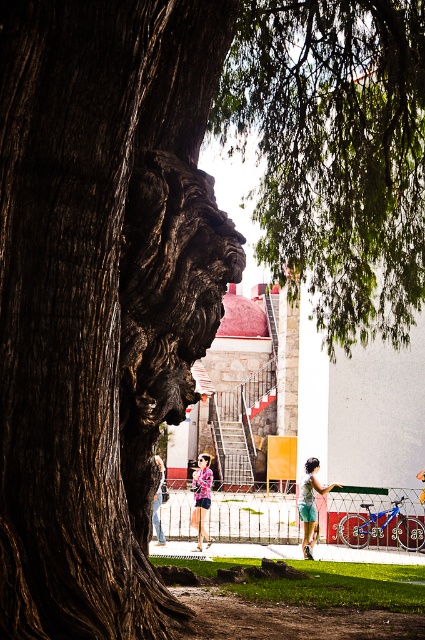
Consider the image. Who is taller, dark brown textured bark at left or pink fabric dress at center?

dark brown textured bark at left is taller.

Who is more distant from viewer, (85, 179) or (206, 513)?

The point (206, 513) is more distant.

Where is `dark brown textured bark at left`? This screenshot has width=425, height=640. dark brown textured bark at left is located at coordinates (101, 294).

Which is above, green leafy tree at upper center or brushed metal jacket at center?

Positioned higher is green leafy tree at upper center.

Is point (342, 237) positioned behind point (164, 536)?

No.

This screenshot has width=425, height=640. I want to click on green leafy tree at upper center, so click(x=336, y=154).

Does dark brown textured bark at left have a smaller size compared to denim shorts at lower center?

Incorrect, dark brown textured bark at left is not smaller in size than denim shorts at lower center.

From the picture: Who is higher up, dark brown textured bark at left or denim shorts at lower center?

dark brown textured bark at left is higher up.

Is point (6, 173) farther from viewer compared to point (306, 532)?

No, (6, 173) is in front of (306, 532).

The width and height of the screenshot is (425, 640). I want to click on dark brown textured bark at left, so click(101, 294).